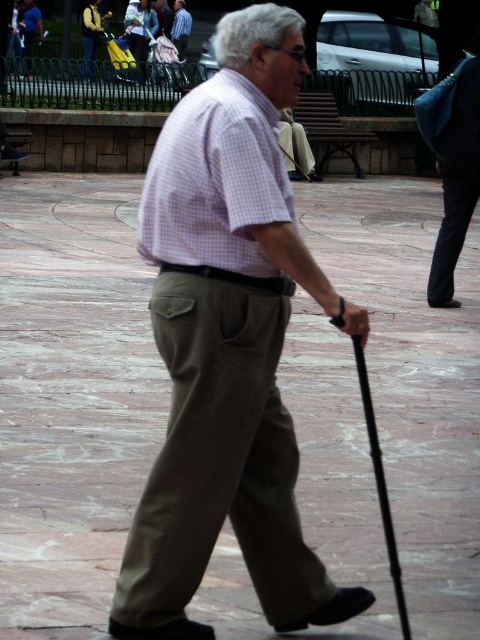
Does brown stone pavement at center have a smaller size compared to light blue shirt at center?

Incorrect, brown stone pavement at center is not smaller in size than light blue shirt at center.

Between brown stone pavement at center and light blue shirt at center, which one has more height?

brown stone pavement at center is taller.

The height and width of the screenshot is (640, 480). I want to click on brown stone pavement at center, so click(72, 397).

Find the location of a particular element. brown stone pavement at center is located at coordinates 72,397.

Who is positioned more to the right, purple checkered shirt at center or light blue shirt at center?

Positioned to the right is purple checkered shirt at center.

Between purple checkered shirt at center and light blue shirt at center, which one appears on the left side from the viewer's perspective?

Positioned to the left is light blue shirt at center.

Identify the location of purple checkered shirt at center. (215, 180).

Image resolution: width=480 pixels, height=640 pixels. I want to click on brown stone pavement at center, so click(72, 397).

Does brown stone pavement at center come behind light brown cotton pants at center?

Yes, it is behind light brown cotton pants at center.

I want to click on brown stone pavement at center, so click(x=72, y=397).